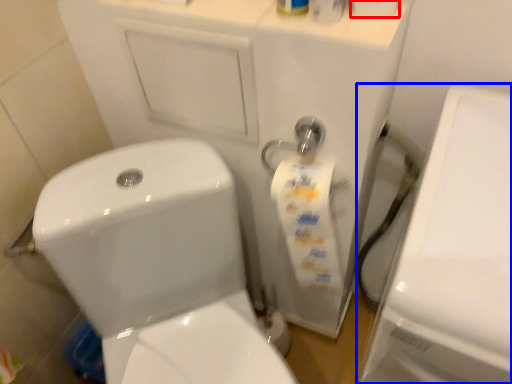
Question: Among these objects, which one is nearest to the camera, toilet paper (highlighted by a red box) or porcelain (highlighted by a blue box)?

Choices:
 (A) toilet paper
 (B) porcelain

Answer: (B)